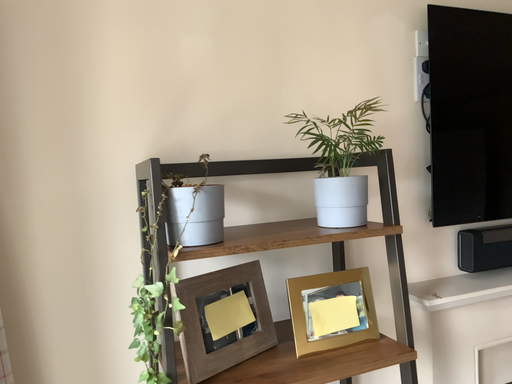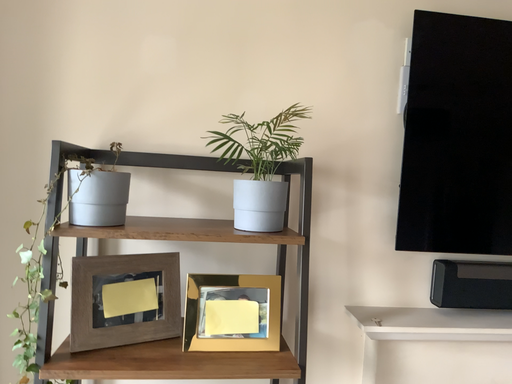
Question: How did the camera likely rotate when shooting the video?

Choices:
 (A) rotated left
 (B) rotated right

Answer: (A)